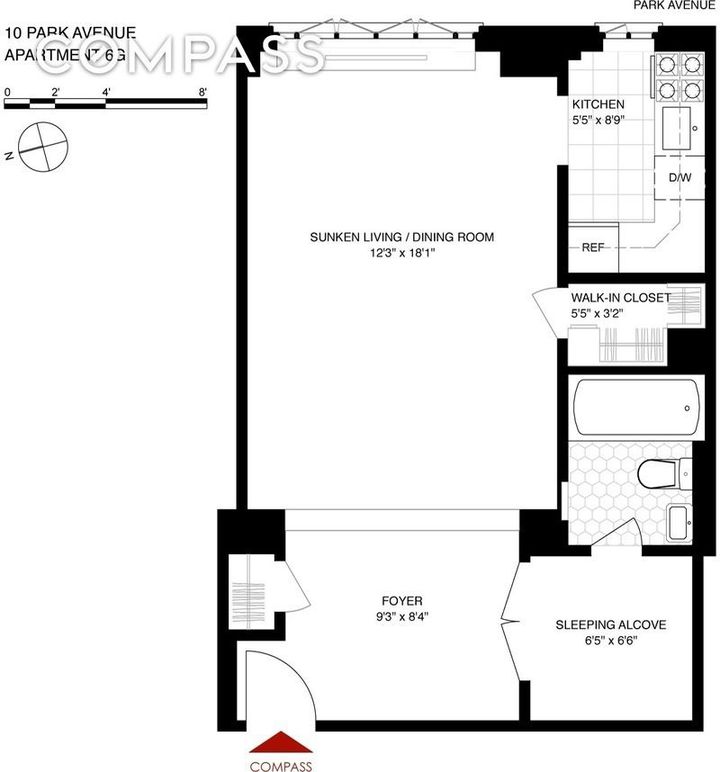
Locate an element on the screen. This screenshot has width=720, height=772. "kitchen" written in black capital letters is located at coordinates (598, 103).